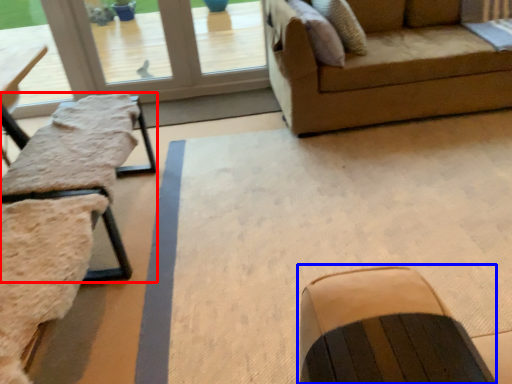
Question: Which of the following is the farthest to the observer, table (highlighted by a red box) or rocking chair (highlighted by a blue box)?

Choices:
 (A) table
 (B) rocking chair

Answer: (A)